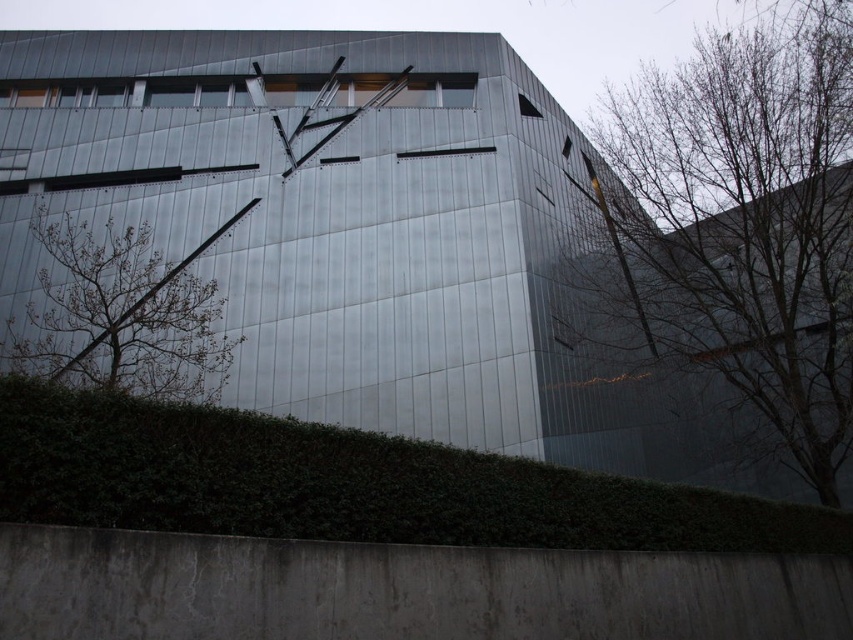
Question: From the image, what is the correct spatial relationship of green leafy hedge at lower center in relation to bare branches at left?

Choices:
 (A) below
 (B) above

Answer: (A)

Question: Is bare branches at right positioned in front of bare branches at left?

Choices:
 (A) yes
 (B) no

Answer: (B)

Question: Which point is farther from the camera taking this photo?

Choices:
 (A) (556, 516)
 (B) (97, 298)
 (C) (671, 262)

Answer: (C)

Question: Estimate the real-world distances between objects in this image. Which object is closer to the bare branches at left?

Choices:
 (A) bare branches at right
 (B) green leafy hedge at lower center

Answer: (B)

Question: Which point is closer to the camera?

Choices:
 (A) [112, 368]
 (B) [114, 428]
 (C) [718, 72]

Answer: (B)

Question: Can you confirm if green leafy hedge at lower center is thinner than bare branches at left?

Choices:
 (A) no
 (B) yes

Answer: (B)